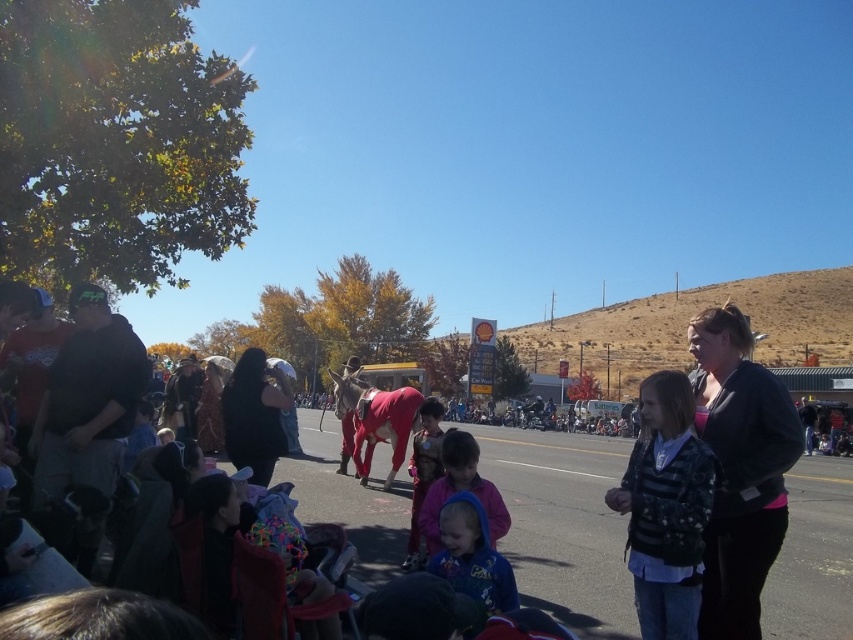
Question: Which of the following is the farthest from the observer?

Choices:
 (A) (463, 477)
 (B) (405, 480)
 (C) (679, 401)
 (D) (462, 570)

Answer: (B)

Question: Which point appears farthest from the camera in this image?

Choices:
 (A) (633, 568)
 (B) (490, 611)

Answer: (A)

Question: Does red fabric donkey at center appear on the left side of blue fleece hoodie at center?

Choices:
 (A) no
 (B) yes

Answer: (A)

Question: Does striped sweater at center have a larger size compared to blue fleece jacket at center?

Choices:
 (A) no
 (B) yes

Answer: (A)

Question: Estimate the real-world distances between objects in this image. Which object is farther from the blue fleece hoodie at center?

Choices:
 (A) blue fleece jacket at center
 (B) red fabric donkey at center

Answer: (B)

Question: Is red fabric donkey at center to the right of blue fleece hoodie at center from the viewer's perspective?

Choices:
 (A) yes
 (B) no

Answer: (A)